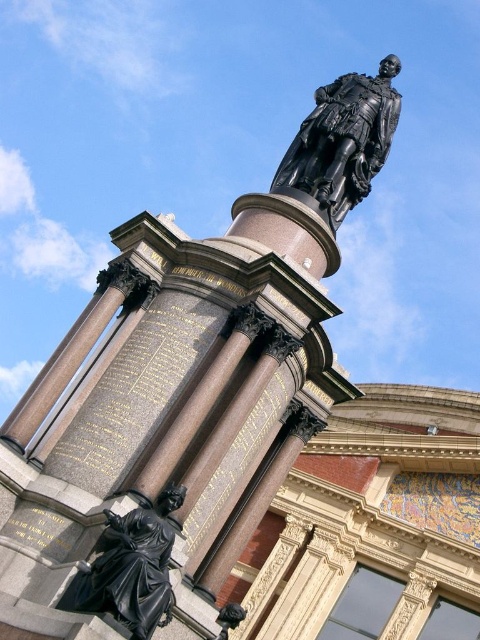
You are a tourist standing in front of the monument and want to take a photo that includes both the bronze statue at upper center and the black polished statue at lower left. Based on their positions, which statue should you focus on first to ensure both are in the frame?

The bronze statue at upper center is located above the black polished statue at lower left, so you should focus on the bronze statue at upper center first to ensure both are in the frame.

You are an art student trying to sketch the monument. You notice the bronze statue at upper center and the black polished statue at lower left. Which statue should you focus on first if you want to draw the wider one?

The bronze statue at upper center might be wider than the black polished statue at lower left, so you should focus on the bronze statue at upper center first.